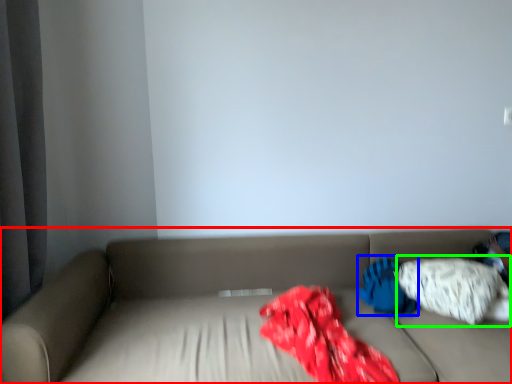
Question: Which is farther away from studio couch (highlighted by a red box)? pillow (highlighted by a blue box) or pillow (highlighted by a green box)?

Choices:
 (A) pillow
 (B) pillow

Answer: (A)